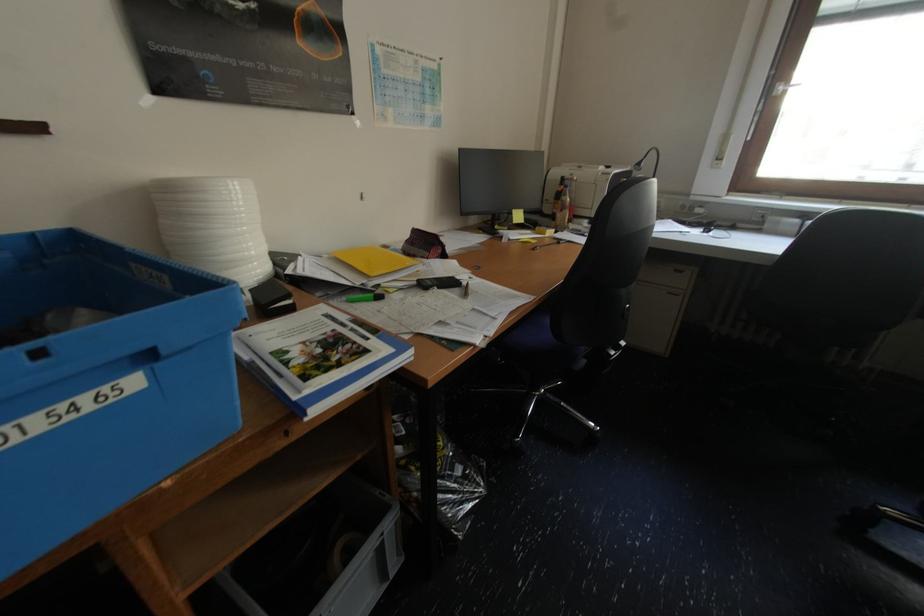
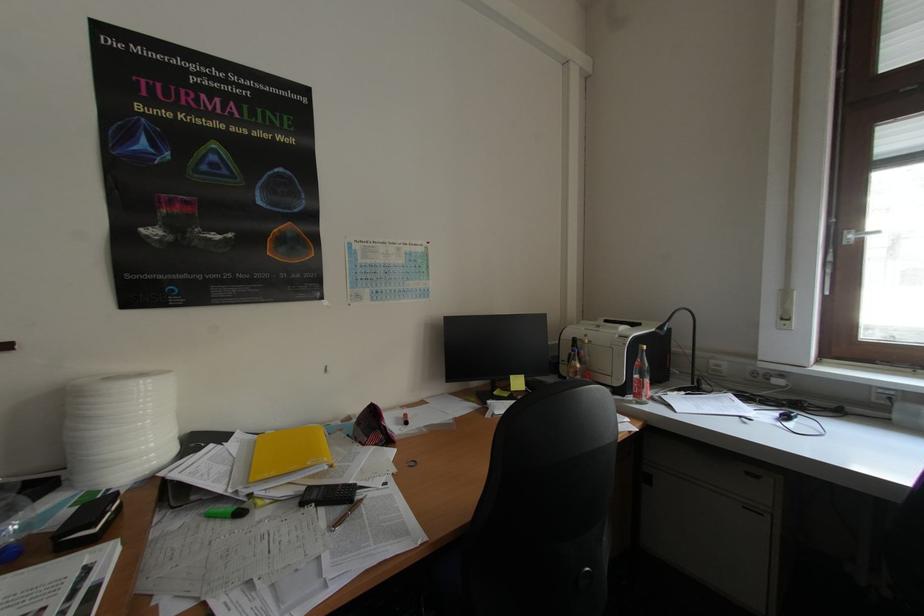
The images are taken continuously from a first-person perspective. In which direction are you moving?

The cameraman walked toward right, forward.